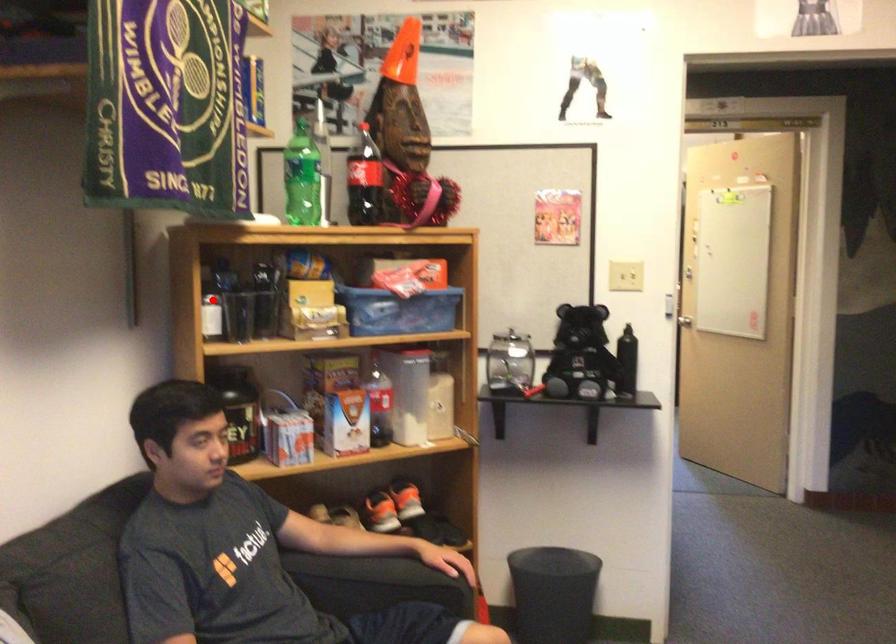
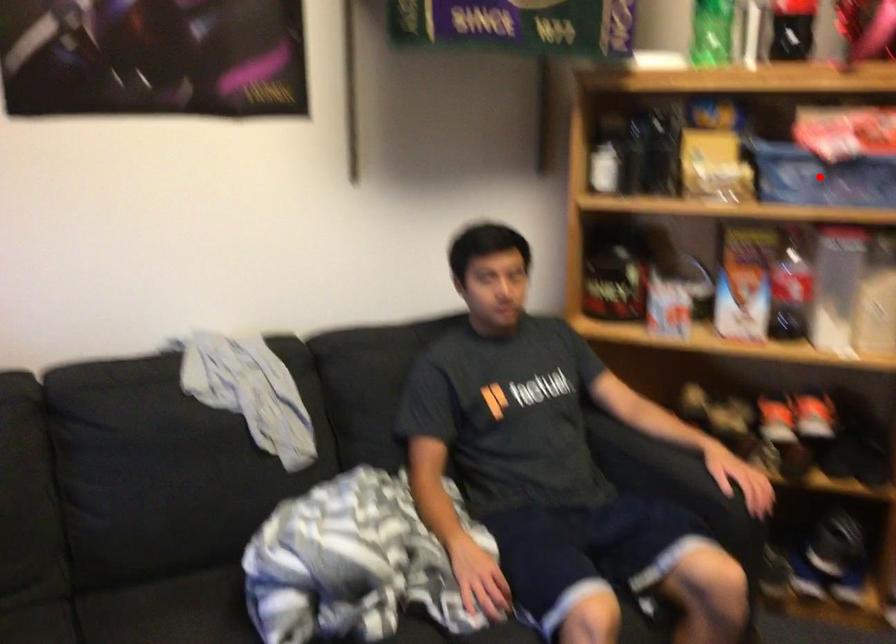
I am providing you with two images of the same scene from different viewpoints. A red point is marked on the first image and another point is marked on the second image. Is the marked point in image1 the same physical position as the marked point in image2?

No